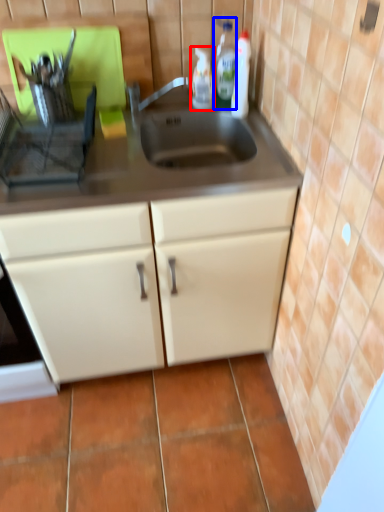
Question: Which of the following is the farthest to the observer, bottle (highlighted by a red box) or bottle (highlighted by a blue box)?

Choices:
 (A) bottle
 (B) bottle

Answer: (A)